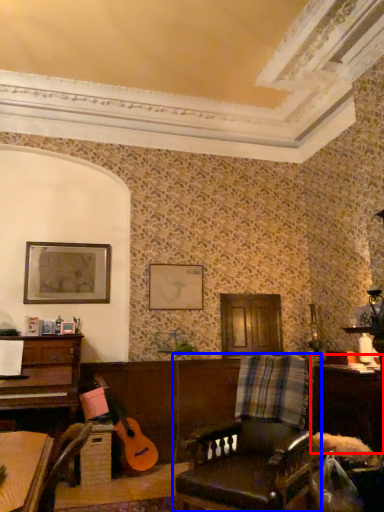
Question: Among these objects, which one is farthest to the camera, table (highlighted by a red box) or chair (highlighted by a blue box)?

Choices:
 (A) table
 (B) chair

Answer: (A)